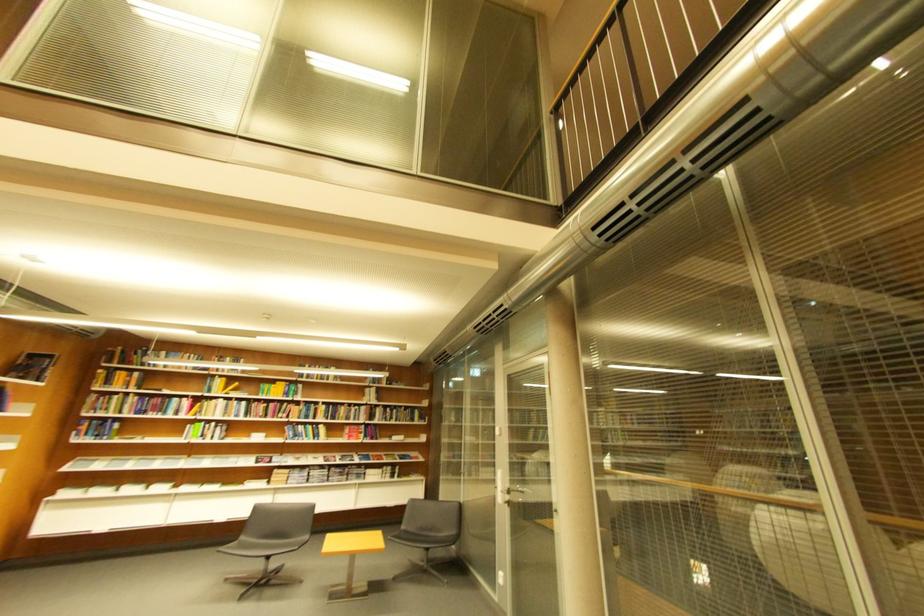
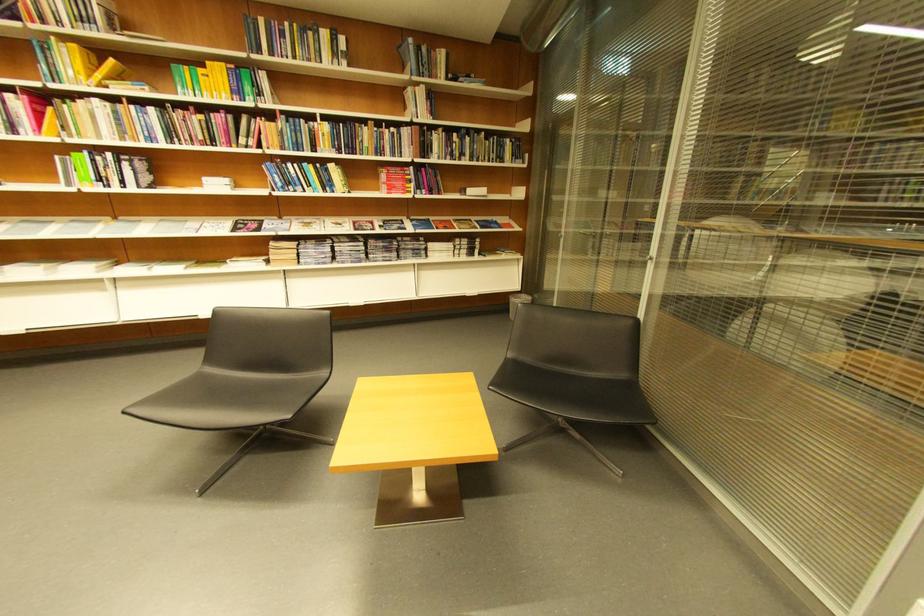
In the second image, find the point that corresponds to (x=367, y=408) in the first image.

(403, 131)